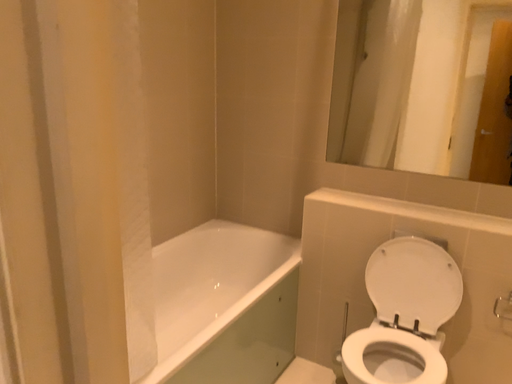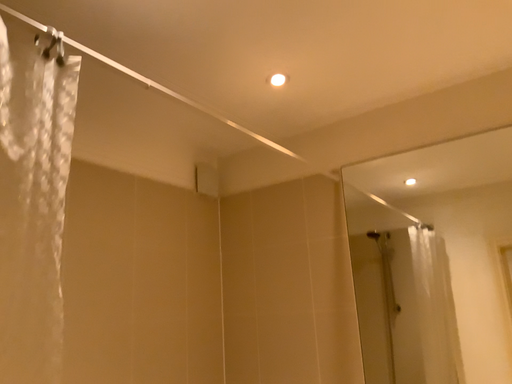
Question: How did the camera likely rotate when shooting the video?

Choices:
 (A) rotated upward
 (B) rotated downward

Answer: (A)